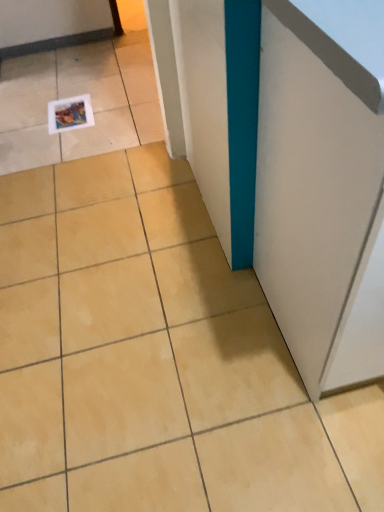
This screenshot has height=512, width=384. What do you see at coordinates (320, 201) in the screenshot?
I see `white matte cabinet at right` at bounding box center [320, 201].

The height and width of the screenshot is (512, 384). Find the location of `white matte cabinet at right`. white matte cabinet at right is located at coordinates (320, 201).

I want to click on white matte cabinet at right, so click(x=320, y=201).